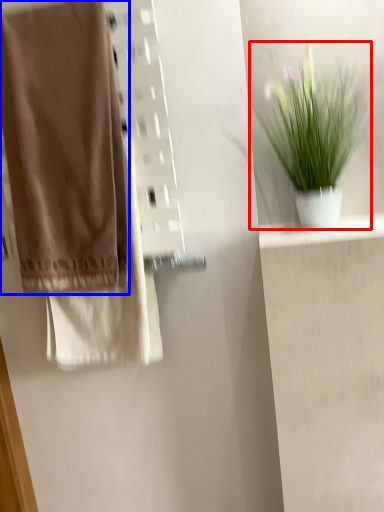
Question: Which of the following is the closest to the observer, houseplant (highlighted by a red box) or towel (highlighted by a blue box)?

Choices:
 (A) houseplant
 (B) towel

Answer: (A)